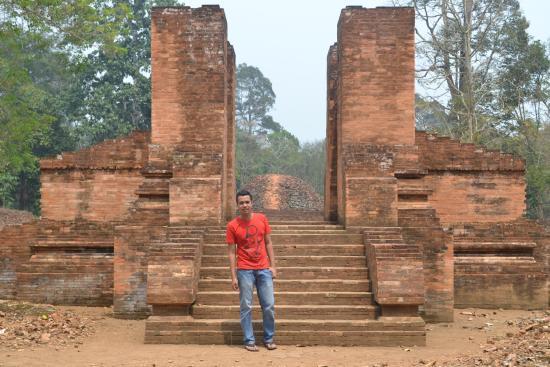
I want to click on stairs, so pos(313,276).